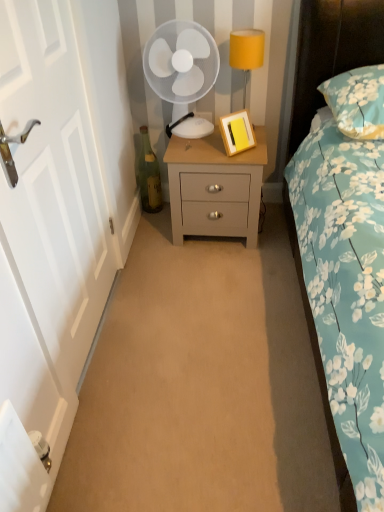
The height and width of the screenshot is (512, 384). Identify the location of vacant space in between white painted wood door at left and green glass bottle at lower left. (139, 245).